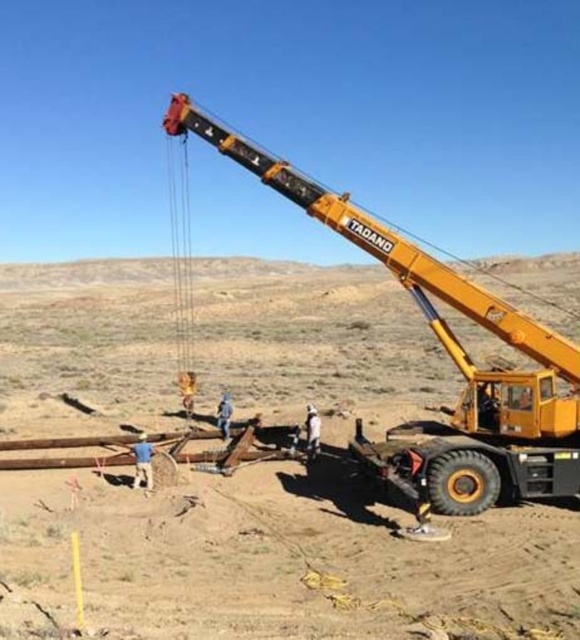
You are a construction supervisor checking the layout of the site. The dirt field at center and the yellow metallic crane at upper right are two key elements. Which of these two objects has a greater width?

The dirt field at center has a greater width than the yellow metallic crane at upper right according to the description.

You are a construction worker who needs to move equipment from the dirt field at center to the yellow metallic crane at upper right. Which direction should you move the equipment?

You should move the equipment to the right, as the dirt field at center is located to the left of the yellow metallic crane at upper right.

Looking at this image, you are a construction worker who needs to place a new safety barrier between the dirt field at center and the yellow metallic crane at upper right. Which object should you place the barrier closer to to ensure it is visible from the crane operator?

The dirt field at center is taller than the yellow metallic crane at upper right, so placing the barrier closer to the dirt field at center will ensure it is visible from the crane operator.